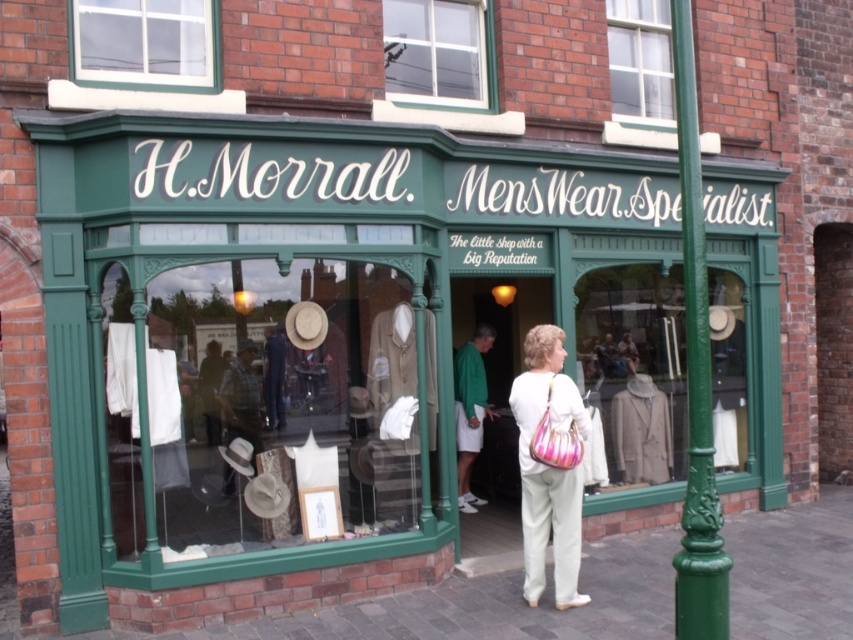
Who is taller, white fabric handbag at center or clear glass window at upper center?

Standing taller between the two is white fabric handbag at center.

Can you confirm if white fabric handbag at center is positioned to the right of clear glass window at upper center?

Yes, white fabric handbag at center is to the right of clear glass window at upper center.

Find the location of a particular element. Image resolution: width=853 pixels, height=640 pixels. white fabric handbag at center is located at coordinates (548, 468).

Where is `white fabric handbag at center`? This screenshot has width=853, height=640. white fabric handbag at center is located at coordinates (548, 468).

Which is more to the right, green painted metal pole at right or clear glass window at upper center?

green painted metal pole at right is more to the right.

Looking at this image, is green painted metal pole at right thinner than clear glass window at upper center?

Yes.

Locate an element on the screen. The width and height of the screenshot is (853, 640). green painted metal pole at right is located at coordinates (695, 378).

Does green painted metal pole at right appear on the right side of white fabric handbag at center?

A: Indeed, green painted metal pole at right is positioned on the right side of white fabric handbag at center.

Does green painted metal pole at right appear under white fabric handbag at center?

Incorrect, green painted metal pole at right is not positioned below white fabric handbag at center.

Is point (708, 545) positioned in front of point (540, 477)?

Yes, it is.

This screenshot has height=640, width=853. I want to click on green painted metal pole at right, so click(695, 378).